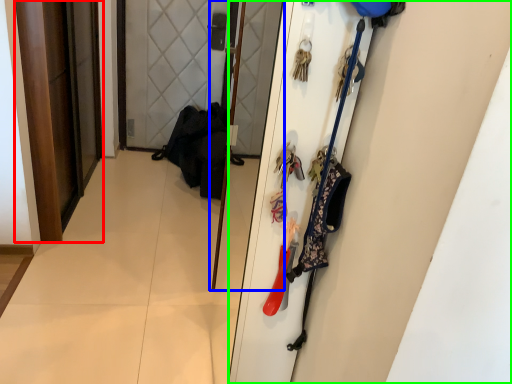
Question: Which is nearer to the door (highlighted by a red box)? screen door (highlighted by a blue box) or door (highlighted by a green box).

Choices:
 (A) screen door
 (B) door

Answer: (A)